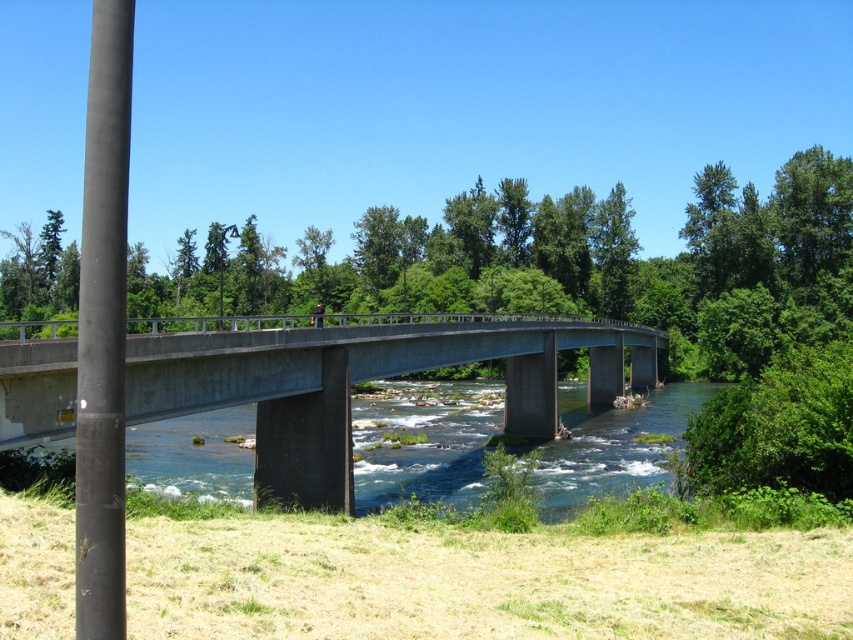
You are a photographer planning to capture the entire scene of the concrete bridge at center and the smooth black pole at left in a single shot. Based on their sizes, which object will appear larger in the photo?

The concrete bridge at center will appear larger in the photo because it is bigger than the smooth black pole at left according to the description.

You are standing on the concrete bridge and want to determine which of the two points, point (326, 381) or point (112, 193), is closer to you. Which one would you say is nearer?

Point (326, 381) is further to the viewer than point (112, 193), so the point (112, 193) is closer to you.

You are a pedestrian standing on the dry grass in the foreground. You want to cross the river using the bridge. Which direction should you walk towards relative to the smooth black pole at left to reach the concrete bridge at center?

You should walk towards the right side of the smooth black pole at left to reach the concrete bridge at center, as the concrete bridge at center is positioned on the right side of the smooth black pole at left.